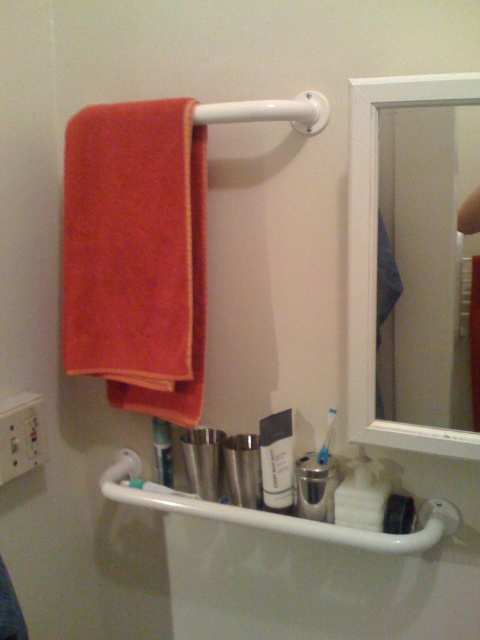
Does brushed metal toothbrush at lower center appear on the right side of white plastic toothbrush at lower center?

No, brushed metal toothbrush at lower center is not to the right of white plastic toothbrush at lower center.

Can you confirm if brushed metal toothbrush at lower center is bigger than white plastic toothbrush at lower center?

Correct, brushed metal toothbrush at lower center is larger in size than white plastic toothbrush at lower center.

Between point (156, 454) and point (331, 412), which one is positioned behind?

Point (156, 454)

I want to click on brushed metal toothbrush at lower center, so click(163, 451).

Does orange terry cloth towel at left come behind white glossy lotion at center?

No, orange terry cloth towel at left is in front of white glossy lotion at center.

Who is positioned more to the right, orange terry cloth towel at left or white glossy lotion at center?

white glossy lotion at center

This screenshot has height=640, width=480. Identify the location of orange terry cloth towel at left. (136, 253).

Is white glossy lotion at center shorter than white plastic toothbrush at lower center?

In fact, white glossy lotion at center may be taller than white plastic toothbrush at lower center.

Does white glossy lotion at center have a lesser width compared to white plastic toothbrush at lower center?

No, white glossy lotion at center is not thinner than white plastic toothbrush at lower center.

You are a GUI agent. You are given a task and a screenshot of the screen. Output one action in this format:
    pyautogui.click(x=<x>, y=<y>)
    Task: Click on the white glossy lotion at center
    
    Given the screenshot: What is the action you would take?
    pyautogui.click(x=276, y=460)

This screenshot has width=480, height=640. Find the location of `white glossy lotion at center`. white glossy lotion at center is located at coordinates (276, 460).